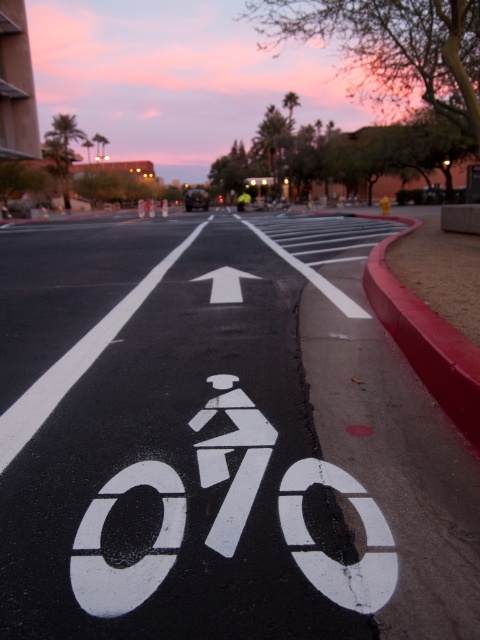
You are a cyclist planning to ride through the white painted bike lane at center and the white matte arrow at center. Which of these two features takes up more space on the road?

The white matte arrow at center occupies more space than the white painted bike lane at center.

You are a cyclist approaching the white painted bike lane at center and the white matte arrow at center. Which object should you position yourself closer to while riding?

You should position yourself closer to the white matte arrow at center because the white painted bike lane at center is located below it, indicating the arrow points towards the direction of the lane.